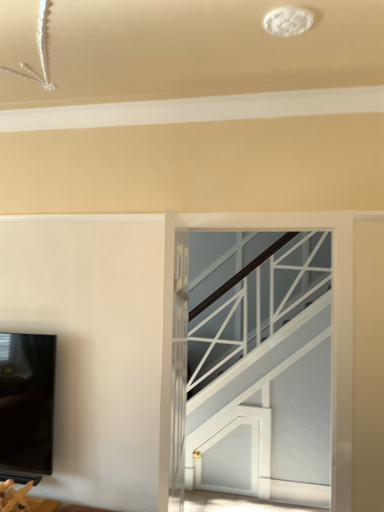
Question: From the image's perspective, is clear glass door at center on matte gold figurine at lower left?

Choices:
 (A) no
 (B) yes

Answer: (B)

Question: Does clear glass door at center have a smaller size compared to matte gold figurine at lower left?

Choices:
 (A) yes
 (B) no

Answer: (B)

Question: From the image's perspective, does clear glass door at center appear lower than matte gold figurine at lower left?

Choices:
 (A) yes
 (B) no

Answer: (B)

Question: Can matte gold figurine at lower left be found inside clear glass door at center?

Choices:
 (A) no
 (B) yes

Answer: (A)

Question: Is clear glass door at center oriented away from matte gold figurine at lower left?

Choices:
 (A) yes
 (B) no

Answer: (B)

Question: Is clear glass door at center next to matte gold figurine at lower left and touching it?

Choices:
 (A) no
 (B) yes

Answer: (A)

Question: Is matte gold figurine at lower left to the left of clear glass door at center from the viewer's perspective?

Choices:
 (A) no
 (B) yes

Answer: (B)

Question: Is matte gold figurine at lower left bigger than clear glass door at center?

Choices:
 (A) yes
 (B) no

Answer: (B)

Question: Is the depth of matte gold figurine at lower left less than that of clear glass door at center?

Choices:
 (A) yes
 (B) no

Answer: (A)

Question: Is matte gold figurine at lower left next to clear glass door at center?

Choices:
 (A) yes
 (B) no

Answer: (B)

Question: Considering the relative sizes of matte gold figurine at lower left and clear glass door at center in the image provided, is matte gold figurine at lower left shorter than clear glass door at center?

Choices:
 (A) no
 (B) yes

Answer: (B)

Question: Is matte gold figurine at lower left positioned beyond the bounds of clear glass door at center?

Choices:
 (A) no
 (B) yes

Answer: (B)

Question: From a real-world perspective, relative to matte gold figurine at lower left, is clear glass door at center vertically above or below?

Choices:
 (A) above
 (B) below

Answer: (A)